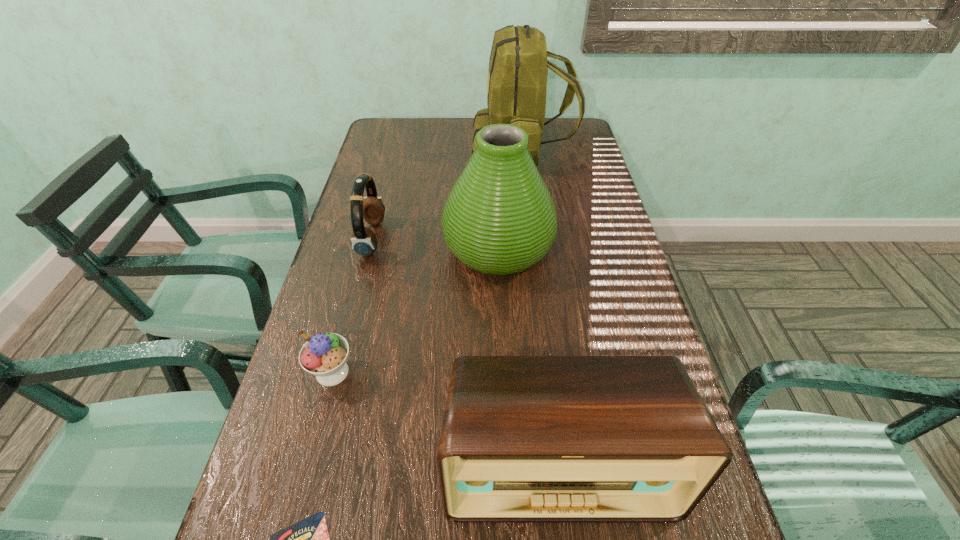
Where is `vacant space at the right edge of the desktop`? The image size is (960, 540). vacant space at the right edge of the desktop is located at coordinates (628, 354).

This screenshot has height=540, width=960. Find the location of `vacant region at the far right corner of the desktop`. vacant region at the far right corner of the desktop is located at coordinates (552, 148).

Find the location of a particular element. This screenshot has height=540, width=960. vacant space that is in between the backpack and the headset is located at coordinates (447, 194).

This screenshot has height=540, width=960. In order to click on empty space that is in between the second tallest object and the headset in this screenshot , I will do `click(435, 243)`.

The height and width of the screenshot is (540, 960). I want to click on free space between the second shortest object and the fourth tallest object, so click(352, 306).

Find the location of a particular element. This screenshot has height=540, width=960. vacant space that is in between the fourth shortest object and the backpack is located at coordinates (540, 308).

Identify the location of vacant region between the icecream and the backpack. The image size is (960, 540). coord(427,261).

At what (x,y) coordinates should I click in order to perform the action: click on object that is the fifth nearest to the radio receiver. Please return your answer as a coordinate pair (x, y). Looking at the image, I should click on (518, 67).

In order to click on object that is the third closest to the fourth farthest object in this screenshot , I will do click(x=499, y=218).

Identify the location of free space that satisfies the following two spatial constraints: 1. on the front-facing side of the farthest object; 2. on the front side of the second shortest object. Image resolution: width=960 pixels, height=540 pixels. (551, 372).